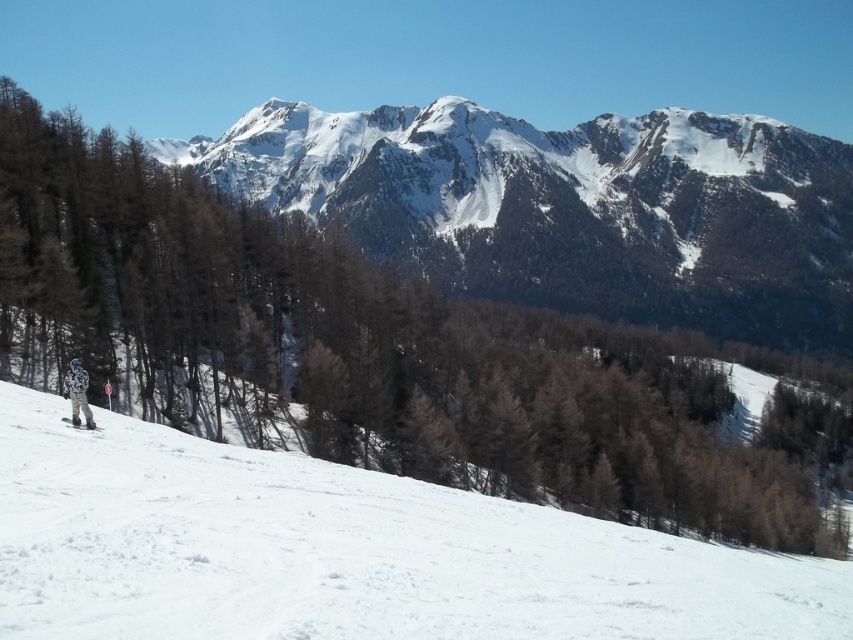
Is white snow at lower left wider than white snowboarder at lower left?

Correct, the width of white snow at lower left exceeds that of white snowboarder at lower left.

Between point (15, 392) and point (74, 422), which one is positioned in front?

Positioned in front is point (74, 422).

Identify the location of white snow at lower left. (346, 552).

Which is above, white snowboarder at lower left or white matte ski at lower left?

white snowboarder at lower left

Is point (78, 371) more distant than point (70, 419)?

Yes.

Find the location of `white snowboarder at lower left`. white snowboarder at lower left is located at coordinates (77, 392).

Between point (509, 148) and point (93, 429), which one is positioned behind?

The point (509, 148) is more distant.

Locate an element on the screen. The image size is (853, 640). snowy granite mountain at upper center is located at coordinates (572, 209).

Where is `snowy granite mountain at upper center`? The image size is (853, 640). snowy granite mountain at upper center is located at coordinates (572, 209).